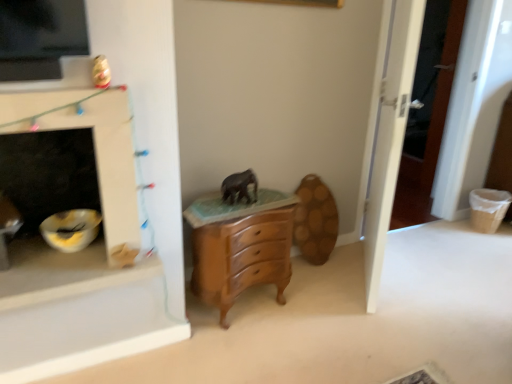
Question: Is white glossy fireplace at left further to camera compared to white wooden door at right?

Choices:
 (A) yes
 (B) no

Answer: (B)

Question: Is white glossy fireplace at left not inside white wooden door at right?

Choices:
 (A) no
 (B) yes

Answer: (B)

Question: From the image's perspective, is white glossy fireplace at left on top of white wooden door at right?

Choices:
 (A) no
 (B) yes

Answer: (A)

Question: Can you confirm if white glossy fireplace at left is bigger than white wooden door at right?

Choices:
 (A) yes
 (B) no

Answer: (B)

Question: Is white glossy fireplace at left far away from white wooden door at right?

Choices:
 (A) yes
 (B) no

Answer: (A)

Question: Is white glossy fireplace at left to the left of white wooden door at right from the viewer's perspective?

Choices:
 (A) yes
 (B) no

Answer: (A)

Question: Does white glossy fireplace at left appear on the left side of wooden chest of drawers at center?

Choices:
 (A) yes
 (B) no

Answer: (A)

Question: Is white glossy fireplace at left aimed at wooden chest of drawers at center?

Choices:
 (A) yes
 (B) no

Answer: (B)

Question: From the image's perspective, is white glossy fireplace at left on wooden chest of drawers at center?

Choices:
 (A) no
 (B) yes

Answer: (B)

Question: From the image's perspective, does white glossy fireplace at left appear lower than wooden chest of drawers at center?

Choices:
 (A) no
 (B) yes

Answer: (A)

Question: Is white glossy fireplace at left far away from wooden chest of drawers at center?

Choices:
 (A) yes
 (B) no

Answer: (B)

Question: Is white glossy fireplace at left further to the viewer compared to wooden chest of drawers at center?

Choices:
 (A) no
 (B) yes

Answer: (A)

Question: Can you confirm if white glossy fireplace at left is taller than matte gray elephant at center?

Choices:
 (A) no
 (B) yes

Answer: (B)